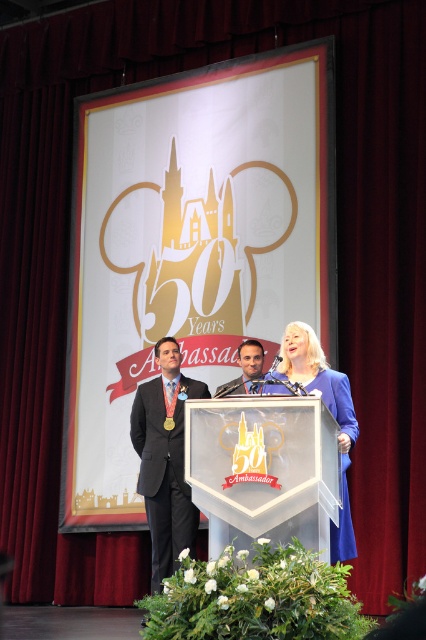
Is blue satin dress at center smaller than dark blue fabric business suit at center?

No, blue satin dress at center is not smaller than dark blue fabric business suit at center.

Is blue satin dress at center further to the viewer compared to dark blue fabric business suit at center?

That is False.

The height and width of the screenshot is (640, 426). Identify the location of blue satin dress at center. (331, 412).

Between matte black suit at left and dark blue fabric business suit at center, which one appears on the left side from the viewer's perspective?

matte black suit at left

Measure the distance between point (195, 536) and camera.

Point (195, 536) and camera are 16.02 meters apart from each other.

Which is in front, point (175, 339) or point (227, 388)?

Positioned in front is point (227, 388).

The image size is (426, 640). What are the coordinates of `matte black suit at left` in the screenshot? It's located at (164, 460).

Does blue satin dress at center appear under matte gold medal at center?

Yes.

Does blue satin dress at center have a lesser height compared to matte gold medal at center?

No, blue satin dress at center is not shorter than matte gold medal at center.

Does point (344, 512) come closer to viewer compared to point (245, 358)?

Yes, it is.

Locate an element on the screen. The width and height of the screenshot is (426, 640). blue satin dress at center is located at coordinates (331, 412).